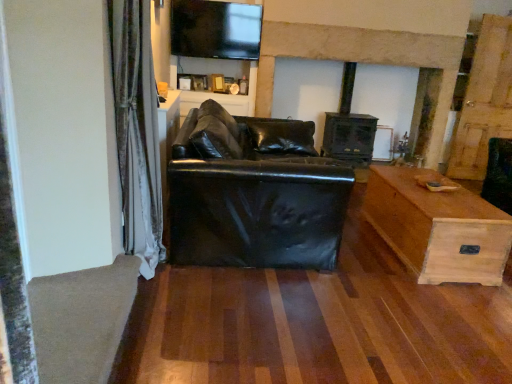
You are a GUI agent. You are given a task and a screenshot of the screen. Output one action in this format:
    pyautogui.click(x=<x>, y=<y>)
    Task: Click on the free location to the right of velvet curtain at left
    
    Given the screenshot: What is the action you would take?
    pyautogui.click(x=194, y=292)